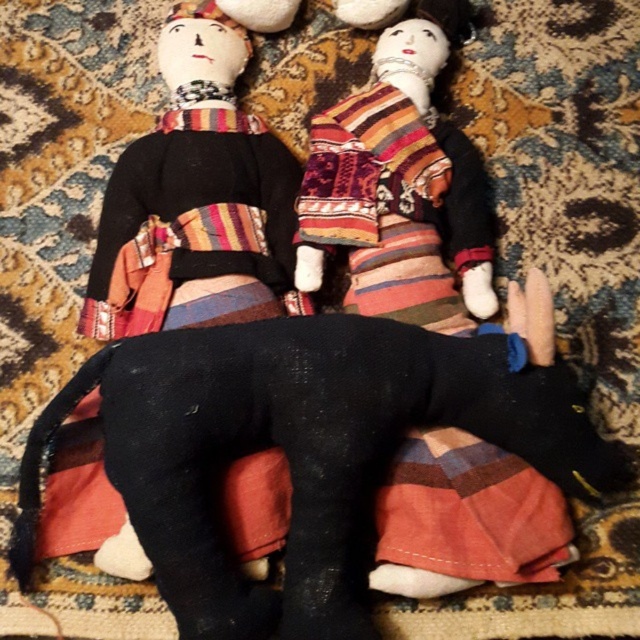
Is matte black doll at left above textured multicolored fabric rag doll at center?

Actually, matte black doll at left is below textured multicolored fabric rag doll at center.

What do you see at coordinates (204, 179) in the screenshot? Image resolution: width=640 pixels, height=640 pixels. I see `matte black doll at left` at bounding box center [204, 179].

The height and width of the screenshot is (640, 640). In order to click on matte black doll at left in this screenshot , I will do `click(204, 179)`.

Find the location of a particular element. This screenshot has height=640, width=640. black fabric dog at center is located at coordinates (310, 444).

Is black fabric dog at center to the right of textured multicolored fabric rag doll at center from the viewer's perspective?

In fact, black fabric dog at center is to the left of textured multicolored fabric rag doll at center.

Identify the location of black fabric dog at center. (310, 444).

In order to click on black fabric dog at center in this screenshot , I will do `click(310, 444)`.

The width and height of the screenshot is (640, 640). In order to click on black fabric dog at center in this screenshot , I will do `click(310, 444)`.

Does black fabric dog at center appear on the right side of matte black doll at left?

Indeed, black fabric dog at center is positioned on the right side of matte black doll at left.

Find the location of a particular element. This screenshot has height=640, width=640. black fabric dog at center is located at coordinates (310, 444).